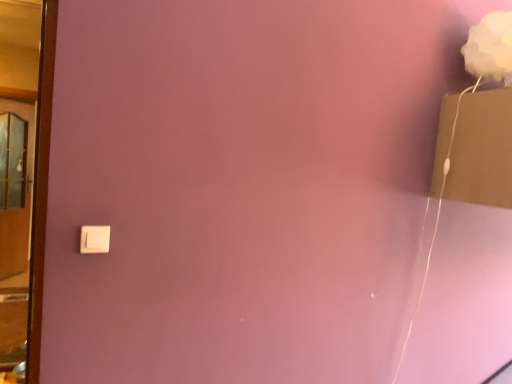
Question: Looking at their shapes, would you say white matte flower at upper right is wider or thinner than white plastic light switch at lower left?

Choices:
 (A) wide
 (B) thin

Answer: (A)

Question: Based on their sizes in the image, would you say white matte flower at upper right is bigger or smaller than white plastic light switch at lower left?

Choices:
 (A) big
 (B) small

Answer: (A)

Question: Based on their relative distances, which object is farther from the white plastic light switch at lower left?

Choices:
 (A) wooden door at left
 (B) white matte flower at upper right

Answer: (A)

Question: Considering the real-world distances, which object is farthest from the white matte flower at upper right?

Choices:
 (A) white plastic light switch at lower left
 (B) wooden door at left

Answer: (B)